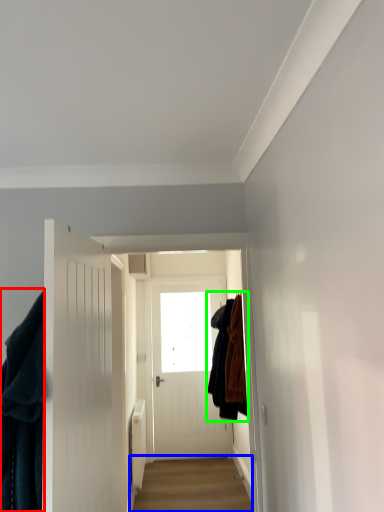
Question: Based on their relative distances, which object is nearer to clothing (highlighted by a red box)? Choose from alley (highlighted by a blue box) and clothing (highlighted by a green box).

Choices:
 (A) alley
 (B) clothing

Answer: (B)